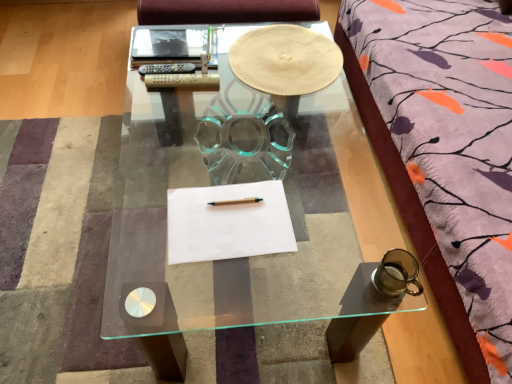
Identify the location of free spot above white paper at upper center, which is the 1th notebook from top to bottom (from a real-world perspective). (170, 36).